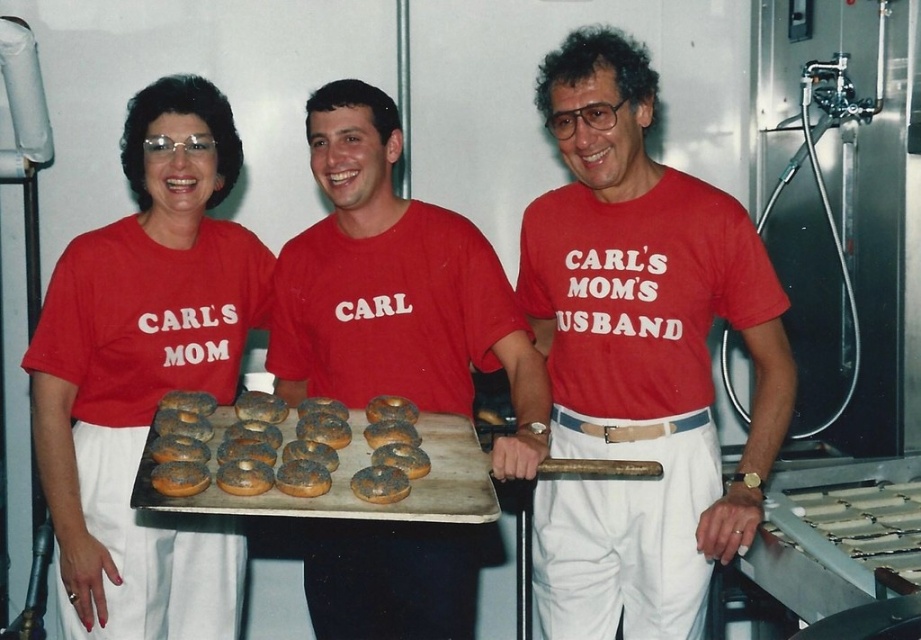
Which of these two, matte red t-shirt at center or matte red shirt at center, stands taller?

With more height is matte red t-shirt at center.

Between point (659, 422) and point (354, 221), which one is positioned in front?

Point (659, 422)

Identify the location of matte red t-shirt at center. This screenshot has height=640, width=921. (639, 356).

Is matte red shirt at center thinner than brown matte donut at center?

No, matte red shirt at center is not thinner than brown matte donut at center.

Who is taller, matte red shirt at center or brown matte donut at center?

Standing taller between the two is matte red shirt at center.

Is point (465, 538) positioned behind point (386, 465)?

Yes, it is.

Locate an element on the screen. The image size is (921, 640). matte red shirt at center is located at coordinates (395, 289).

Where is `matte red t-shirt at center`? The width and height of the screenshot is (921, 640). matte red t-shirt at center is located at coordinates (639, 356).

Is point (580, 232) positioned in front of point (152, 412)?

Yes, point (580, 232) is in front of point (152, 412).

Identify the location of matte red t-shirt at center. This screenshot has height=640, width=921. (x=639, y=356).